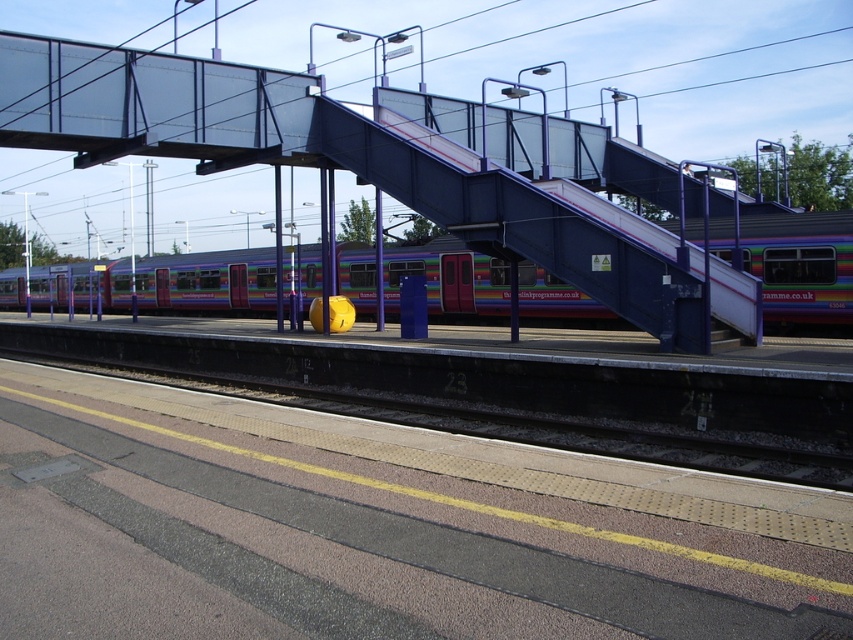
Question: Does metallic blue escalator at center lie behind metallic purple train at center?

Choices:
 (A) no
 (B) yes

Answer: (A)

Question: Considering the relative positions of metallic blue escalator at center and metallic purple train at center in the image provided, where is metallic blue escalator at center located with respect to metallic purple train at center?

Choices:
 (A) right
 (B) left

Answer: (A)

Question: Which of the following is the farthest from the observer?

Choices:
 (A) (189, 307)
 (B) (674, 237)

Answer: (A)

Question: Can you confirm if metallic blue escalator at center is thinner than metallic purple train at center?

Choices:
 (A) yes
 (B) no

Answer: (A)